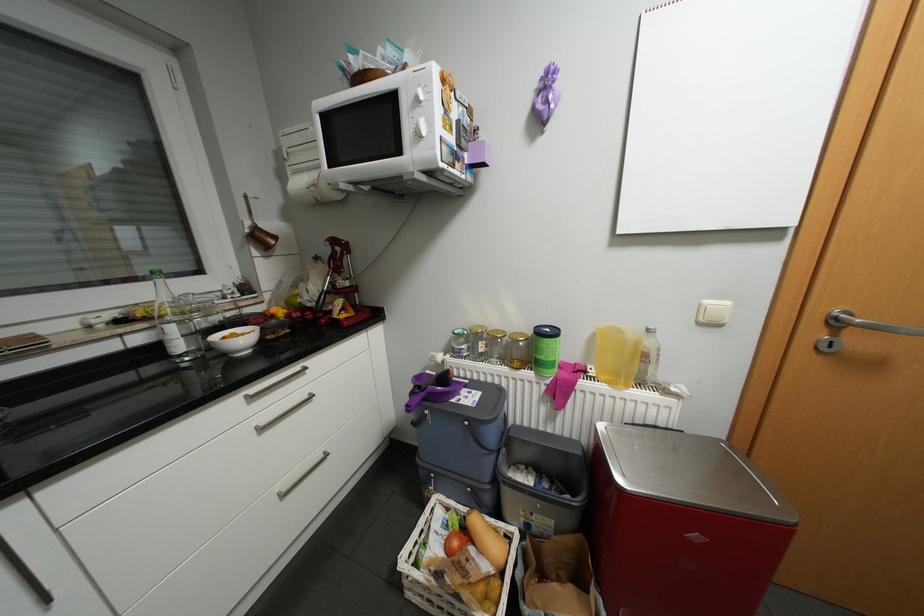
Describe the element at coordinates (712, 313) in the screenshot. I see `the light switch` at that location.